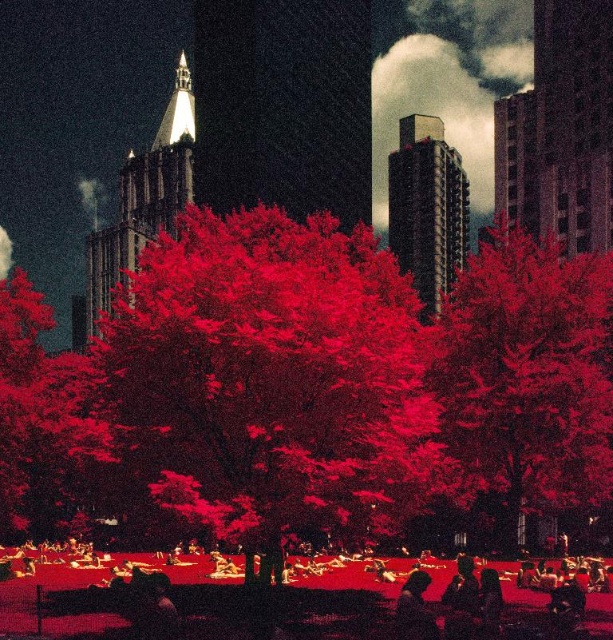
Question: Which point is farther to the camera?

Choices:
 (A) (322, 376)
 (B) (332, 611)
 (C) (503, 310)

Answer: (C)

Question: Which object is the farthest from the bright red leaves at center?

Choices:
 (A) vivid red leaves at center
 (B) smooth skin person at lower right

Answer: (B)

Question: Does vivid red leaves at center have a greater width compared to bright red leaves at center?

Choices:
 (A) no
 (B) yes

Answer: (B)

Question: Which is nearer to the bright red leaves at center?

Choices:
 (A) vivid red leaves at center
 (B) smooth skin person at lower right

Answer: (A)

Question: From the image, what is the correct spatial relationship of vivid red leaves at center in relation to smooth skin person at lower right?

Choices:
 (A) right
 (B) left

Answer: (B)

Question: Can you confirm if vivid red leaves at center is wider than smooth skin person at lower right?

Choices:
 (A) no
 (B) yes

Answer: (B)